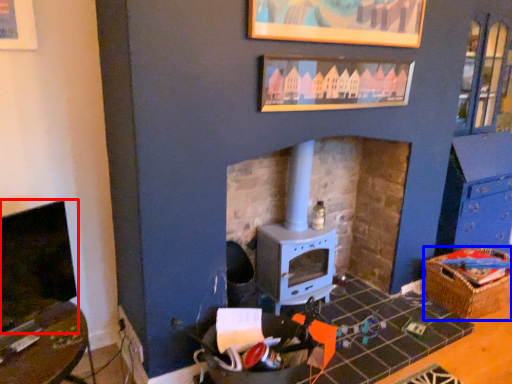
Question: Which point is closer to the camera, fireplace (highlighted by a red box) or crate (highlighted by a blue box)?

Choices:
 (A) fireplace
 (B) crate

Answer: (A)